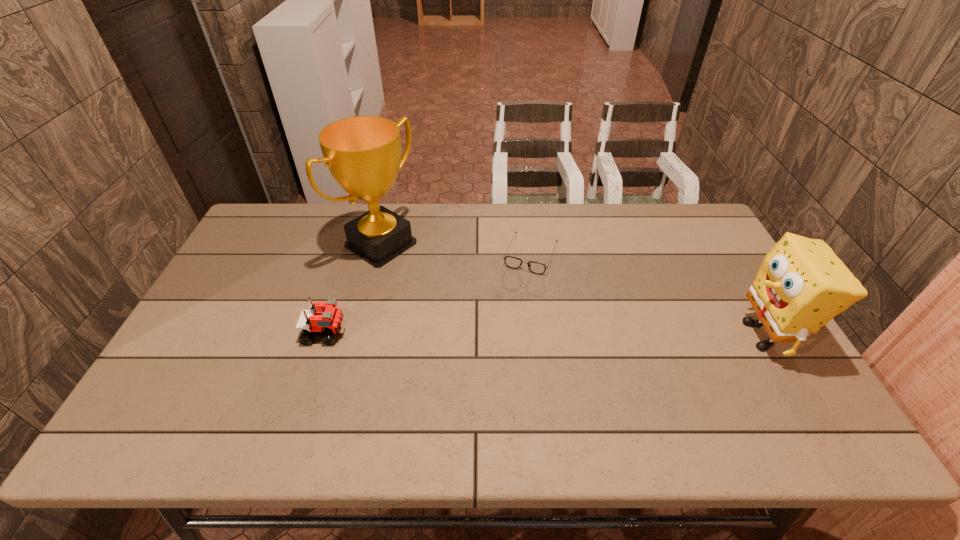
Find the location of a particular element. blank space located 0.090m on the front-facing side of the second object from right to left is located at coordinates (516, 295).

Locate an element on the screen. vacant position located 0.100m on the front-facing side of the second object from right to left is located at coordinates (515, 298).

Locate an element on the screen. The image size is (960, 540). vacant area situated on the front-facing side of the second object from right to left is located at coordinates (504, 325).

At what (x,y) coordinates should I click in order to perform the action: click on free space located on the front-facing side of the tallest object. Please return your answer as a coordinate pair (x, y). Looking at the image, I should click on (478, 308).

Identify the location of free space located on the front-facing side of the tallest object. (494, 319).

The width and height of the screenshot is (960, 540). I want to click on free spot located on the front-facing side of the tallest object, so click(444, 287).

Find the location of a particular element. This screenshot has width=960, height=540. sunglasses that is at the far edge is located at coordinates (512, 262).

Where is `award that is at the far edge`? This screenshot has width=960, height=540. award that is at the far edge is located at coordinates (363, 153).

This screenshot has height=540, width=960. Identify the location of object positioned at the right edge. (801, 284).

You are a GUI agent. You are given a task and a screenshot of the screen. Output one action in this format:
    pyautogui.click(x=<x>, y=<y>)
    Task: Click on the vacant space at the far edge
    This screenshot has width=960, height=540.
    Given the screenshot: What is the action you would take?
    pyautogui.click(x=490, y=224)